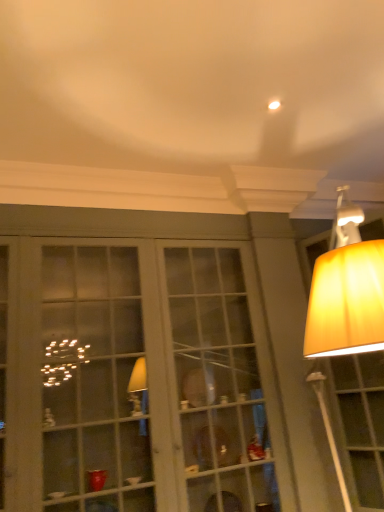
Locate an element on the screen. matte yellow lampshade at upper right is located at coordinates (346, 290).

What do you see at coordinates (346, 290) in the screenshot? I see `matte yellow lampshade at upper right` at bounding box center [346, 290].

Where is `white glass cabinet at center`? The image size is (384, 512). white glass cabinet at center is located at coordinates (137, 380).

This screenshot has height=512, width=384. What do you see at coordinates (137, 380) in the screenshot?
I see `white glass cabinet at center` at bounding box center [137, 380].

Identify the location of matte yellow lampshade at upper right. (346, 290).

Which object is positioned more to the left, white glass cabinet at center or matte yellow lampshade at upper right?

white glass cabinet at center is more to the left.

Looking at this image, is white glass cabinet at center further to the viewer compared to matte yellow lampshade at upper right?

No, the depth of white glass cabinet at center is less than that of matte yellow lampshade at upper right.

Is point (52, 339) less distant than point (343, 312)?

That is False.

From the image's perspective, is white glass cabinet at center above or below matte yellow lampshade at upper right?

From the image's perspective, white glass cabinet at center appears below matte yellow lampshade at upper right.

From a real-world perspective, which is physically below, white glass cabinet at center or matte yellow lampshade at upper right?

A: In real-world perspective, matte yellow lampshade at upper right is lower.

Considering the sizes of objects white glass cabinet at center and matte yellow lampshade at upper right in the image provided, who is thinner, white glass cabinet at center or matte yellow lampshade at upper right?

matte yellow lampshade at upper right is thinner.

Is white glass cabinet at center taller than matte yellow lampshade at upper right?

No.

Does white glass cabinet at center have a smaller size compared to matte yellow lampshade at upper right?

No.

Is white glass cabinet at center spatially inside matte yellow lampshade at upper right, or outside of it?

white glass cabinet at center is outside matte yellow lampshade at upper right.

Are white glass cabinet at center and matte yellow lampshade at upper right far apart?

white glass cabinet at center is positioned a significant distance from matte yellow lampshade at upper right.

Is white glass cabinet at center positioned with its back to matte yellow lampshade at upper right?

No, white glass cabinet at center is not facing the opposite direction of matte yellow lampshade at upper right.

The image size is (384, 512). In the image, there is a white glass cabinet at center. In order to click on lamp below it (from a real-world perspective) in this screenshot , I will do `click(346, 290)`.

Based on their positions, is matte yellow lampshade at upper right located to the left or right of white glass cabinet at center?

In the image, matte yellow lampshade at upper right appears on the right side of white glass cabinet at center.

Does matte yellow lampshade at upper right lie in front of white glass cabinet at center?

No, matte yellow lampshade at upper right is further to the viewer.

Does point (365, 351) appear closer or farther from the camera than point (213, 376)?

Point (365, 351) is positioned closer to the camera compared to point (213, 376).

From the image's perspective, which is below, matte yellow lampshade at upper right or white glass cabinet at center?

white glass cabinet at center.

From a real-world perspective, is matte yellow lampshade at upper right on top of white glass cabinet at center?

Incorrect, from a real-world perspective, matte yellow lampshade at upper right is lower than white glass cabinet at center.

Can you confirm if matte yellow lampshade at upper right is wider than white glass cabinet at center?

No, matte yellow lampshade at upper right is not wider than white glass cabinet at center.

Which of these two, matte yellow lampshade at upper right or white glass cabinet at center, stands taller?

matte yellow lampshade at upper right.

Which of these two, matte yellow lampshade at upper right or white glass cabinet at center, is smaller?

Smaller between the two is matte yellow lampshade at upper right.

Is matte yellow lampshade at upper right not within white glass cabinet at center?

Yes.

Is matte yellow lampshade at upper right far away from white glass cabinet at center?

That's right, there is a large distance between matte yellow lampshade at upper right and white glass cabinet at center.

From the picture: Is matte yellow lampshade at upper right facing towards white glass cabinet at center?

No, matte yellow lampshade at upper right is not turned towards white glass cabinet at center.

Locate an element on the screen. The width and height of the screenshot is (384, 512). lamp lying above the white glass cabinet at center (from the image's perspective) is located at coordinates 346,290.

In order to click on bay window in front of the matte yellow lampshade at upper right in this screenshot , I will do `click(137, 380)`.

The height and width of the screenshot is (512, 384). I want to click on bay window that is below the matte yellow lampshade at upper right (from the image's perspective), so click(x=137, y=380).